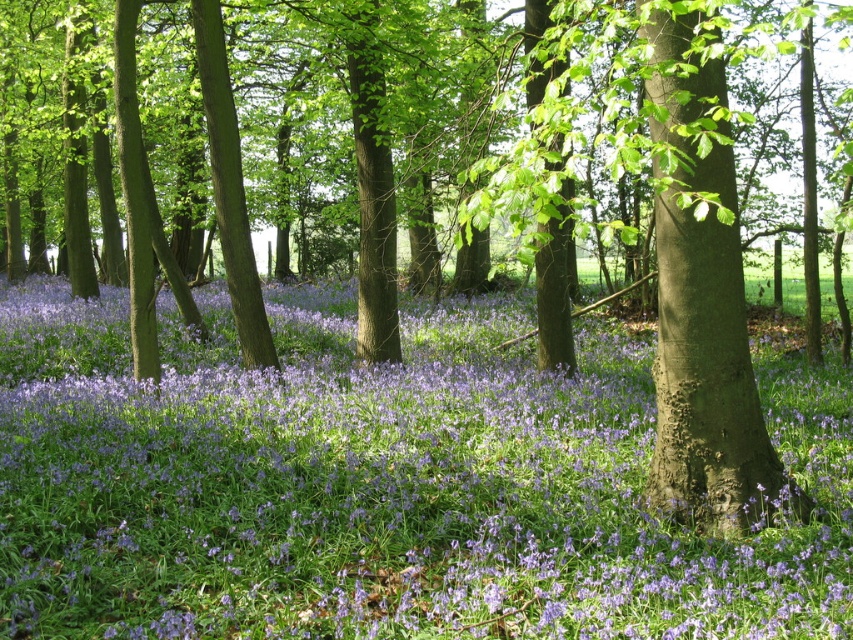
You are a botanist studying the spatial distribution of flowers in this woodland area. You observe the purple matte flower at center. Can you determine its exact 2D coordinates in the image?

The purple matte flower at center is located at the 2D coordinates of point (x=381, y=484).

You are a hiker who wants to place a 2.5 meter long rope between the purple matte flower at center and the smooth brown tree trunk at center. Can you safely stretch the rope between them without it touching the ground?

The distance between the purple matte flower at center and the smooth brown tree trunk at center is 2.47 meters. Since the rope is 2.5 meters long, it will sag slightly when stretched between them, but it should still be possible to safely stretch the rope without it touching the ground.